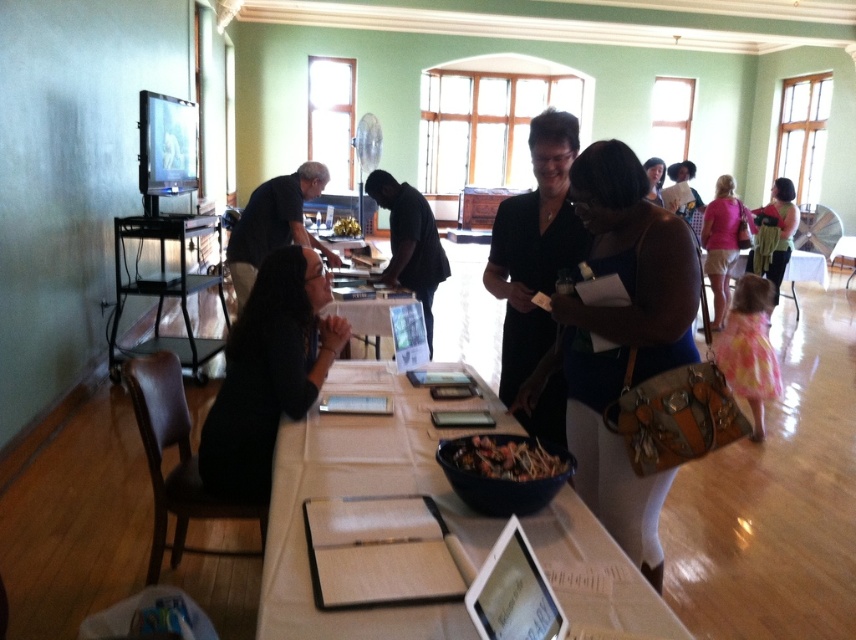
Does matte black dress at center appear under shiny metallic bowl at center?

Actually, matte black dress at center is above shiny metallic bowl at center.

Between matte black dress at center and shiny metallic bowl at center, which one is positioned higher?

Positioned higher is matte black dress at center.

What are the coordinates of `matte black dress at center` in the screenshot? It's located at (620, 339).

Is white paper at center positioned at the back of black matte dress at center?

That is False.

Who is more forward, (x=385, y=464) or (x=242, y=316)?

Point (x=385, y=464)

You are a GUI agent. You are given a task and a screenshot of the screen. Output one action in this format:
    pyautogui.click(x=<x>, y=<y>)
    Task: Click on the white paper at center
    
    Given the screenshot: What is the action you would take?
    pyautogui.click(x=366, y=496)

Is black matte dress at center to the left of green textured dress at center from the viewer's perspective?

Indeed, black matte dress at center is positioned on the left side of green textured dress at center.

Does black matte dress at center have a lesser width compared to green textured dress at center?

Yes.

Is point (269, 272) positioned behind point (776, 268)?

No.

Locate an element on the screen. The width and height of the screenshot is (856, 640). black matte dress at center is located at coordinates (268, 372).